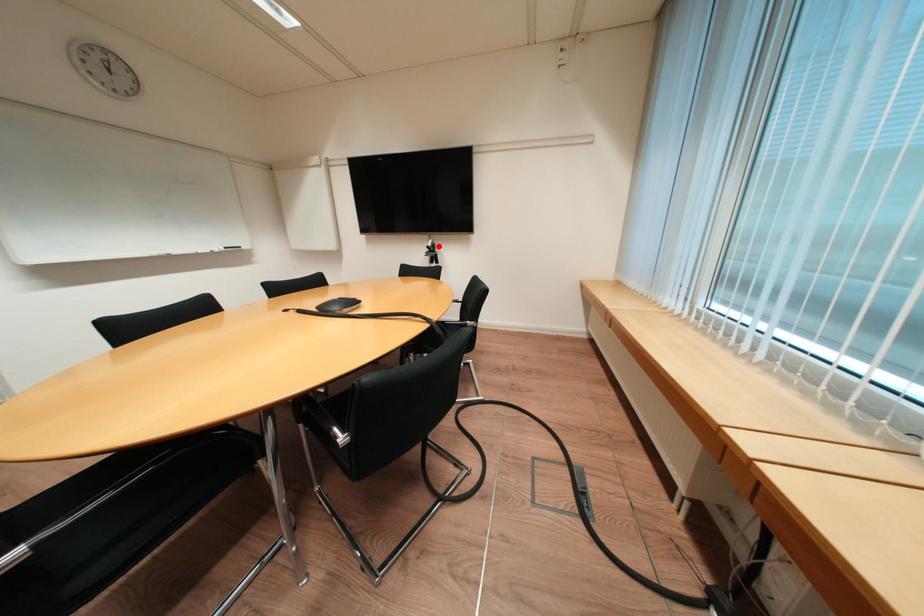
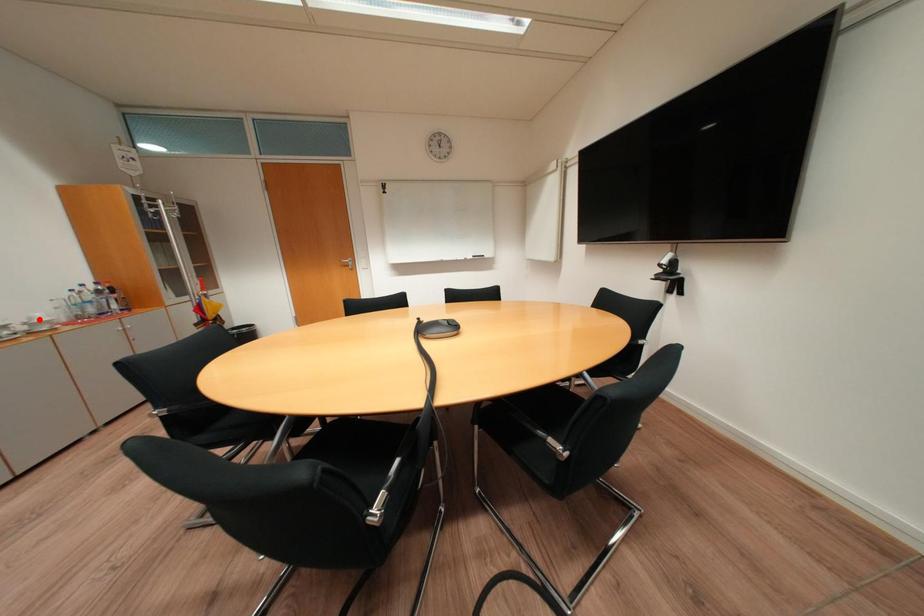
I am providing you with two images of the same scene from different viewpoints. A red point is marked on the first image and another point is marked on the second image. Are the points marked in image1 and image2 representing the same 3D position?

No